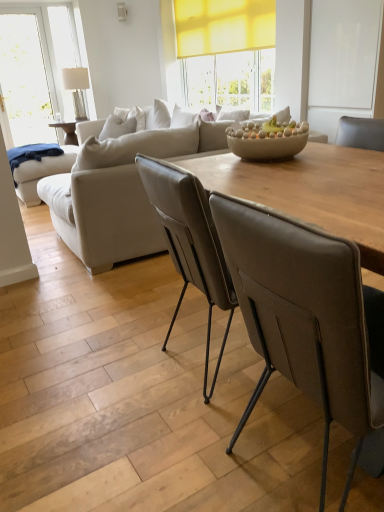
Question: Is wooden table at center taller than brown leather chair at center?

Choices:
 (A) no
 (B) yes

Answer: (A)

Question: From a real-world perspective, is wooden table at center over brown leather chair at center?

Choices:
 (A) yes
 (B) no

Answer: (A)

Question: From the image's perspective, does wooden table at center appear higher than brown leather chair at center?

Choices:
 (A) yes
 (B) no

Answer: (A)

Question: From a real-world perspective, is wooden table at center positioned under brown leather chair at center based on gravity?

Choices:
 (A) no
 (B) yes

Answer: (A)

Question: Is wooden table at center at the left side of brown leather chair at center?

Choices:
 (A) no
 (B) yes

Answer: (B)

Question: Is wooden table at center spatially inside beige leather couch at center, or outside of it?

Choices:
 (A) outside
 (B) inside

Answer: (A)

Question: From their relative heights in the image, would you say wooden table at center is taller or shorter than beige leather couch at center?

Choices:
 (A) tall
 (B) short

Answer: (B)

Question: Is wooden table at center in front of or behind beige leather couch at center in the image?

Choices:
 (A) front
 (B) behind

Answer: (A)

Question: Would you say wooden table at center is to the left or to the right of beige leather couch at center in the picture?

Choices:
 (A) right
 (B) left

Answer: (A)

Question: In the image, is wooden table at center positioned in front of or behind clear glass lamp at upper left?

Choices:
 (A) front
 (B) behind

Answer: (A)

Question: Which is correct: wooden table at center is inside clear glass lamp at upper left, or outside of it?

Choices:
 (A) outside
 (B) inside

Answer: (A)

Question: Is point (188, 175) closer or farther from the camera than point (77, 98)?

Choices:
 (A) closer
 (B) farther

Answer: (A)

Question: Is wooden table at center to the left or to the right of clear glass lamp at upper left in the image?

Choices:
 (A) right
 (B) left

Answer: (A)

Question: Choose the correct answer: Is wooden table at center inside brown leather chair at center or outside it?

Choices:
 (A) outside
 (B) inside

Answer: (A)

Question: Is wooden table at center taller or shorter than brown leather chair at center?

Choices:
 (A) short
 (B) tall

Answer: (A)